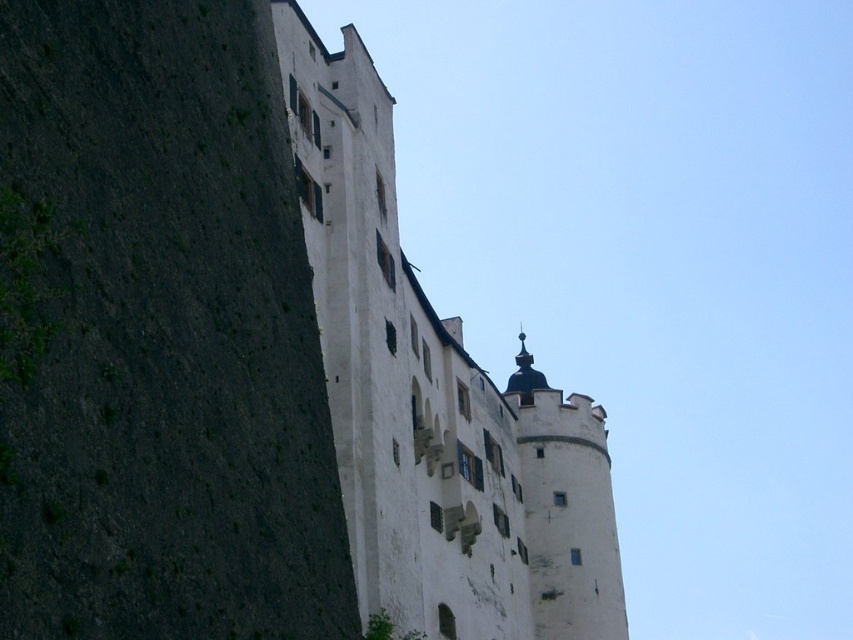
Is white stone castle at center shorter than white stone tower at upper right?

Incorrect, white stone castle at center's height does not fall short of white stone tower at upper right's.

This screenshot has width=853, height=640. I want to click on white stone castle at center, so click(x=434, y=401).

Between dark gray stone wall at left and white stone tower at upper right, which one appears on the left side from the viewer's perspective?

From the viewer's perspective, dark gray stone wall at left appears more on the left side.

Does dark gray stone wall at left come in front of white stone tower at upper right?

That is True.

This screenshot has width=853, height=640. Find the location of `dark gray stone wall at left`. dark gray stone wall at left is located at coordinates (158, 336).

Is dark gray stone wall at left smaller than white stone castle at center?

Yes, dark gray stone wall at left is smaller than white stone castle at center.

Is point (161, 64) closer to camera compared to point (375, 490)?

Yes, it is in front of point (375, 490).

I want to click on dark gray stone wall at left, so click(x=158, y=336).